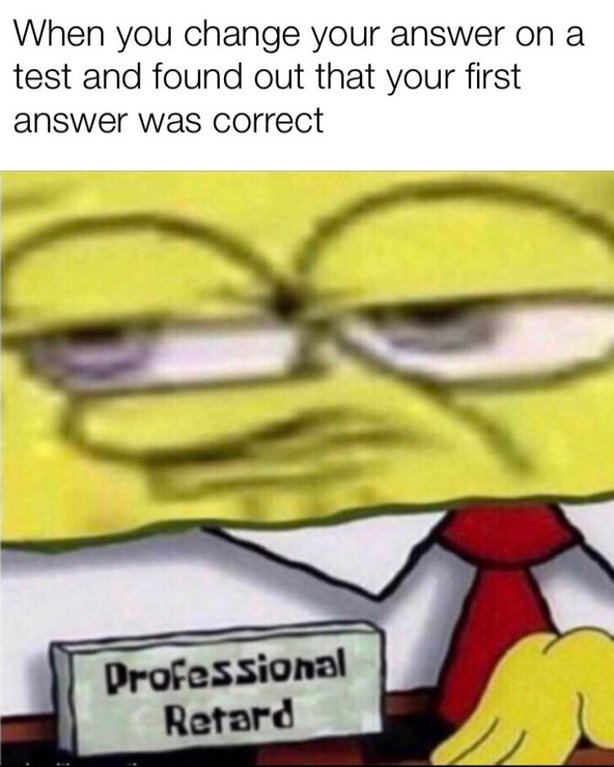
Where is `desktop`? The image size is (614, 767). desktop is located at coordinates (393, 746).